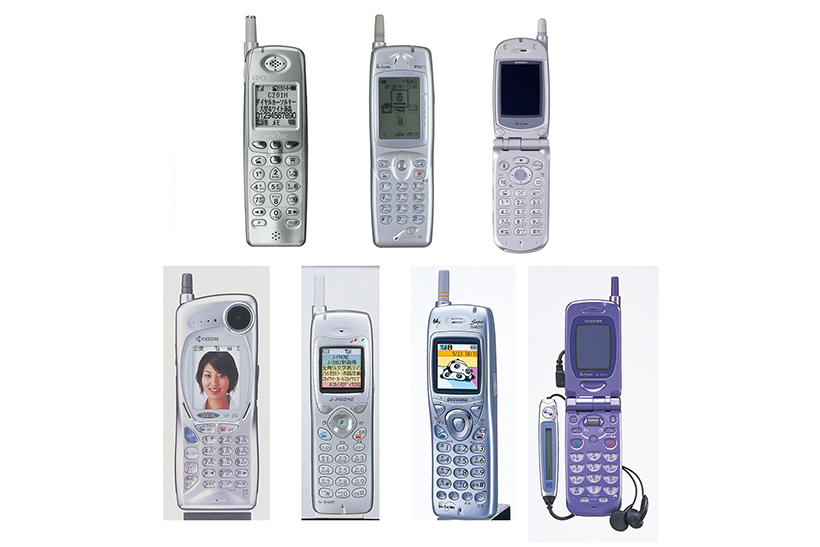
Identify the location of speaker. (244, 317).